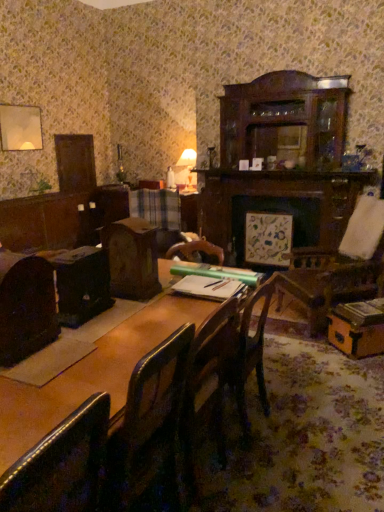
Question: Does matte white table lamp at upper center have a lesser width compared to dark brown leather chair at left, positioned as the second chair in bottom-to-top order?

Choices:
 (A) yes
 (B) no

Answer: (B)

Question: From a real-world perspective, does matte white table lamp at upper center sit lower than dark brown leather chair at left, positioned as the 1th chair in top-to-bottom order?

Choices:
 (A) yes
 (B) no

Answer: (B)

Question: Can you confirm if matte white table lamp at upper center is positioned to the right of dark brown leather chair at left, positioned as the second chair in bottom-to-top order?

Choices:
 (A) no
 (B) yes

Answer: (B)

Question: Can you confirm if matte white table lamp at upper center is bigger than dark brown leather chair at left, positioned as the 1th chair in top-to-bottom order?

Choices:
 (A) yes
 (B) no

Answer: (A)

Question: From the image's perspective, is matte white table lamp at upper center located above dark brown leather chair at left, positioned as the second chair in bottom-to-top order?

Choices:
 (A) yes
 (B) no

Answer: (A)

Question: Is matte white table lamp at upper center positioned far away from dark brown leather chair at left, which is the 2th chair in front-to-back order?

Choices:
 (A) yes
 (B) no

Answer: (A)

Question: Is leather at left, which ranks as the first chair in bottom-to-top order, thinner than wooden table at center?

Choices:
 (A) no
 (B) yes

Answer: (B)

Question: Could you tell me if leather at left, the 2th chair positioned from the back, is facing wooden table at center?

Choices:
 (A) no
 (B) yes

Answer: (A)

Question: From the image's perspective, would you say leather at left, the 1th chair in the front-to-back sequence, is shown under wooden table at center?

Choices:
 (A) no
 (B) yes

Answer: (B)

Question: Is leather at left, which is the second chair in top-to-bottom order, behind wooden table at center?

Choices:
 (A) yes
 (B) no

Answer: (B)

Question: From a real-world perspective, is leather at left, which is the second chair in top-to-bottom order, over wooden table at center?

Choices:
 (A) no
 (B) yes

Answer: (B)

Question: Could wooden table at center be considered to be inside leather at left, which ranks as the first chair in bottom-to-top order?

Choices:
 (A) yes
 (B) no

Answer: (B)

Question: Are dark brown leather chair at left, positioned as the second chair in bottom-to-top order, and leather at left, the 2th chair positioned from the back, far apart?

Choices:
 (A) no
 (B) yes

Answer: (A)